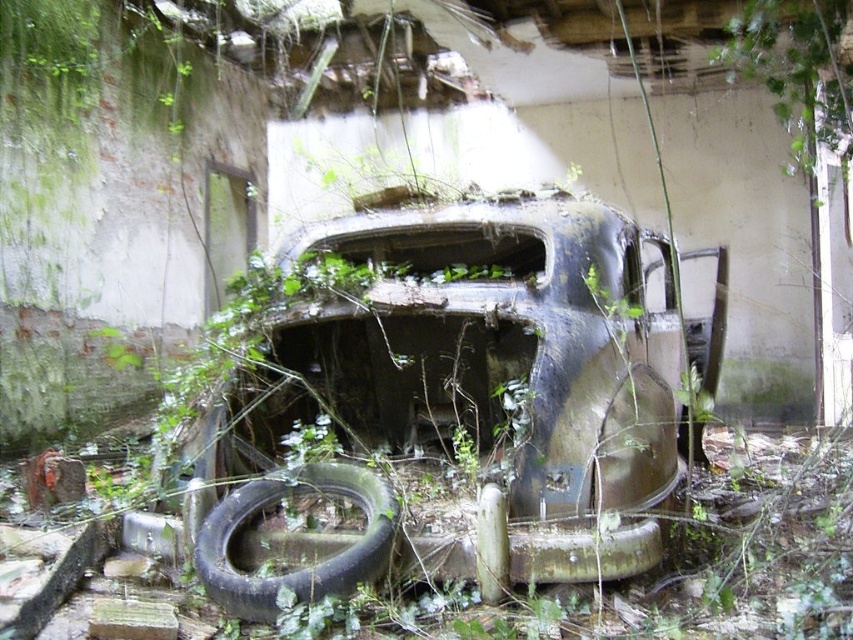
Question: Estimate the real-world distances between objects in this image. Which object is farther from the rusty metal car at center?

Choices:
 (A) green leafy vines at upper center
 (B) black rubber tire at lower left

Answer: (A)

Question: Which point is farther from the camera taking this photo?

Choices:
 (A) (830, 61)
 (B) (451, 323)

Answer: (A)

Question: Observing the image, what is the correct spatial positioning of rusty metal car at center in reference to black rubber tire at lower left?

Choices:
 (A) above
 (B) below

Answer: (A)

Question: Is black rubber tire at lower left positioned behind green leafy vines at upper center?

Choices:
 (A) yes
 (B) no

Answer: (B)

Question: Considering the real-world distances, which object is closest to the green leafy vines at upper center?

Choices:
 (A) black rubber tire at lower left
 (B) rusty metal car at center

Answer: (B)

Question: Can you confirm if rusty metal car at center is bigger than green leafy vines at upper center?

Choices:
 (A) yes
 (B) no

Answer: (A)